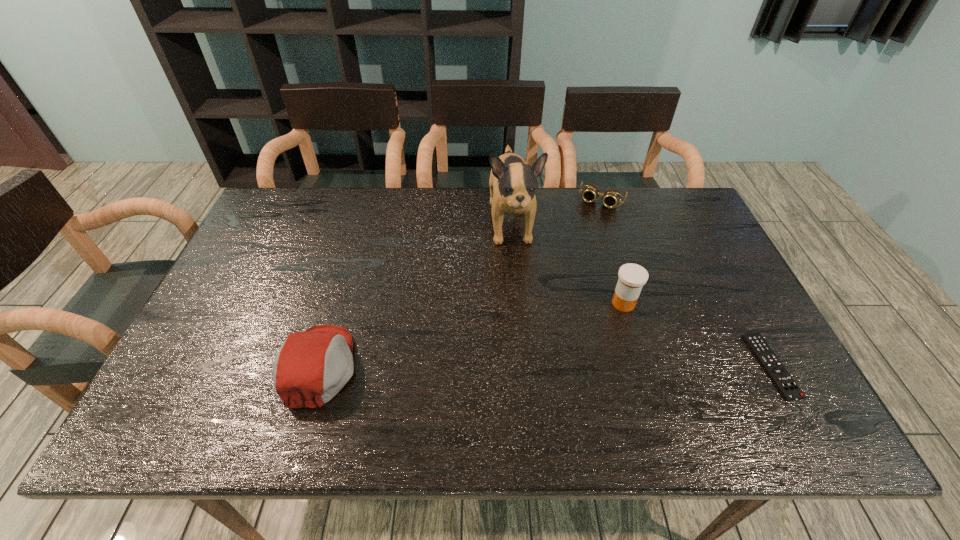
Find the location of a particular element. Image resolution: width=960 pixels, height=540 pixels. vacant space on the desktop that is between the cap and the shortest object and is positioned on the label of the third nearest object is located at coordinates (525, 366).

I want to click on vacant spot on the desktop that is between the leftmost object and the shortest object and is positioned at the face of the second object from left to right, so pyautogui.click(x=533, y=366).

Locate an element on the screen. The image size is (960, 540). free space on the desktop that is between the cap and the remote control and is positioned through the lenses of the goggles is located at coordinates (527, 366).